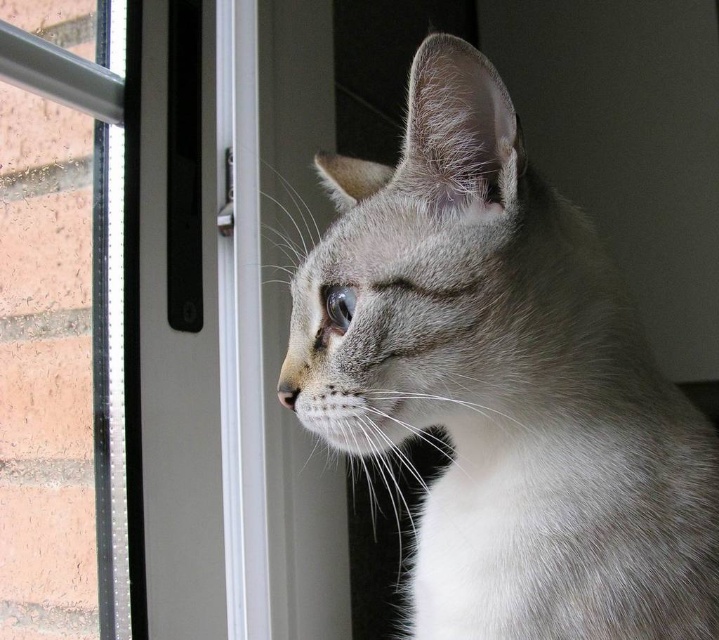
Question: Which object is closer to the camera taking this photo?

Choices:
 (A) clear plastic screen door at center
 (B) gray fur cat at center

Answer: (B)

Question: Which of the following is the closest to the observer?

Choices:
 (A) gray fur cat at center
 (B) clear plastic screen door at center

Answer: (A)

Question: Does gray fur cat at center have a greater width compared to clear plastic screen door at center?

Choices:
 (A) yes
 (B) no

Answer: (A)

Question: Is the position of gray fur cat at center more distant than that of clear plastic screen door at center?

Choices:
 (A) yes
 (B) no

Answer: (B)

Question: Can you confirm if gray fur cat at center is bigger than clear plastic screen door at center?

Choices:
 (A) yes
 (B) no

Answer: (B)